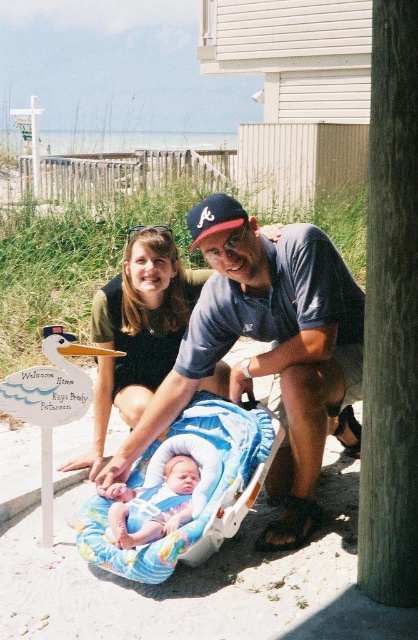
Is blue fabric baby carrier at center to the left of soft blue fabric baby car seat at center from the viewer's perspective?

In fact, blue fabric baby carrier at center is to the right of soft blue fabric baby car seat at center.

Which is more to the left, blue fabric baby carrier at center or soft blue fabric baby car seat at center?

soft blue fabric baby car seat at center

This screenshot has height=640, width=418. Find the location of `blue fabric baby carrier at center`. blue fabric baby carrier at center is located at coordinates (272, 358).

Is blue fabric baby carriage at center shorter than blue fabric baseball cap at center?

Incorrect, blue fabric baby carriage at center's height does not fall short of blue fabric baseball cap at center's.

Between blue fabric baby carriage at center and blue fabric baseball cap at center, which one appears on the right side from the viewer's perspective?

blue fabric baseball cap at center is more to the right.

You are a GUI agent. You are given a task and a screenshot of the screen. Output one action in this format:
    pyautogui.click(x=<x>, y=<y>)
    Task: Click on the blue fabric baby carriage at center
    The image size is (418, 640).
    Given the screenshot: What is the action you would take?
    pyautogui.click(x=206, y=493)

Does blue fabric baby carrier at center have a greater height compared to matte black shirt at center?

Yes.

Based on the photo, between blue fabric baby carrier at center and matte black shirt at center, which one is positioned higher?

matte black shirt at center is above.

Which is in front, point (341, 410) or point (135, 342)?

Positioned in front is point (341, 410).

Locate an element on the screen. Image resolution: width=418 pixels, height=640 pixels. blue fabric baby carrier at center is located at coordinates (272, 358).